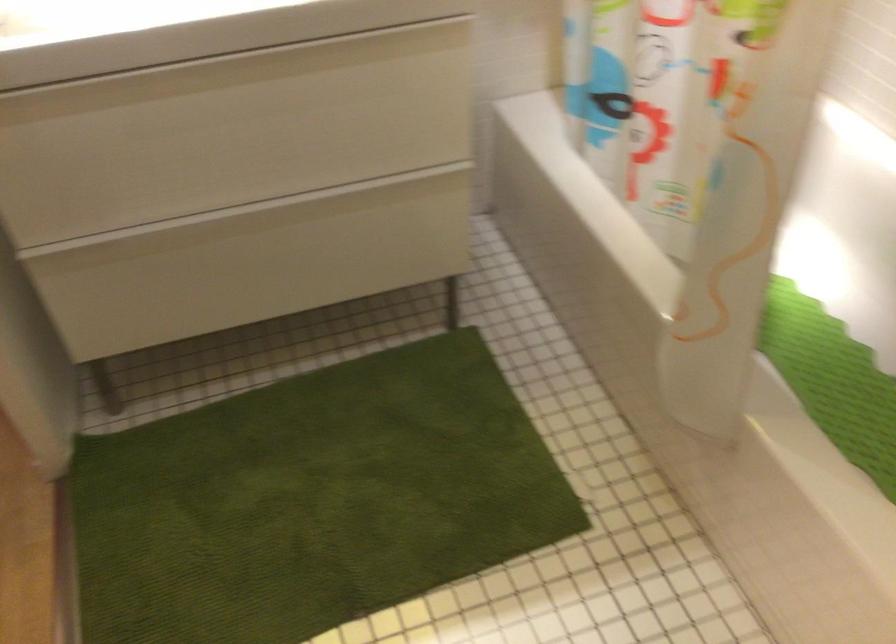
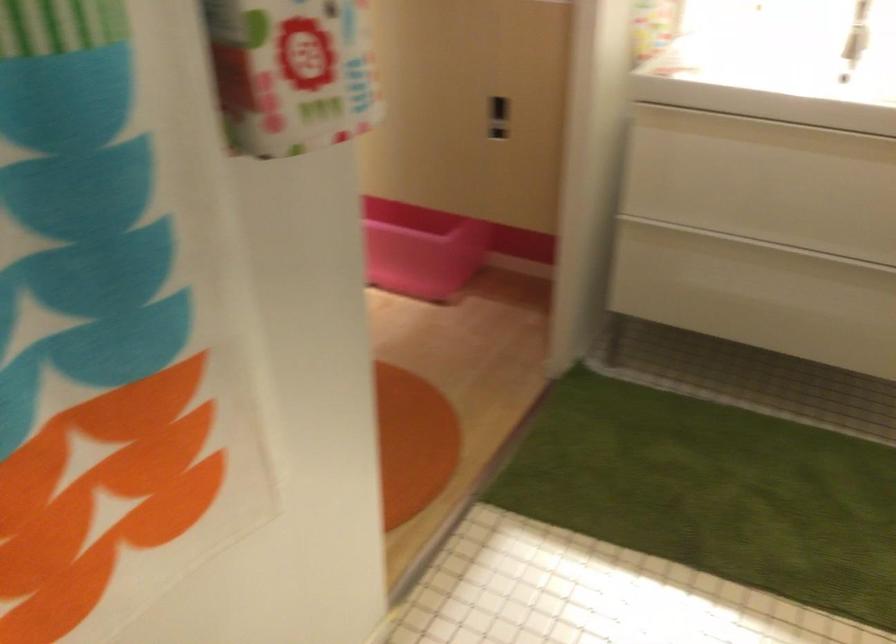
The point at (194, 247) is marked in the first image. Where is the corresponding point in the second image?

(734, 254)